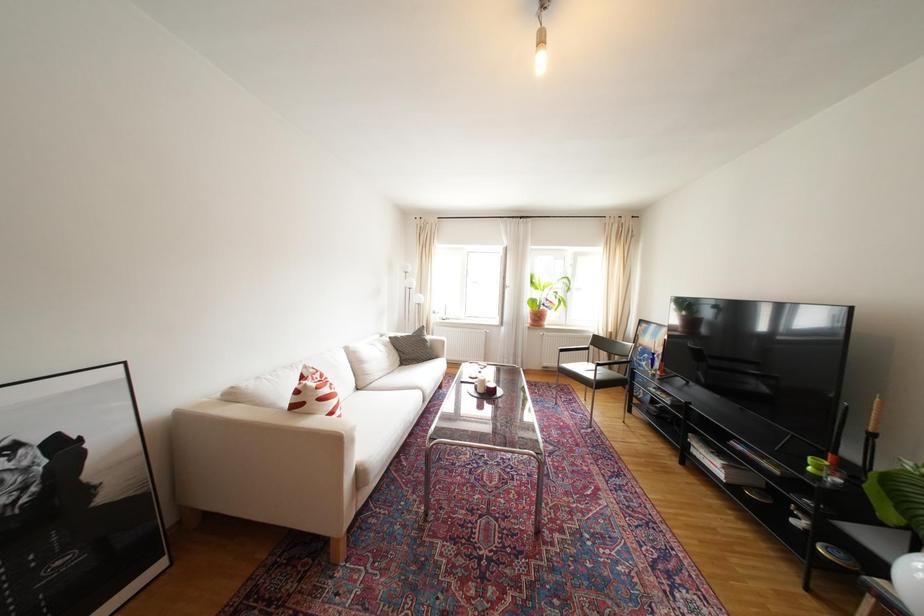
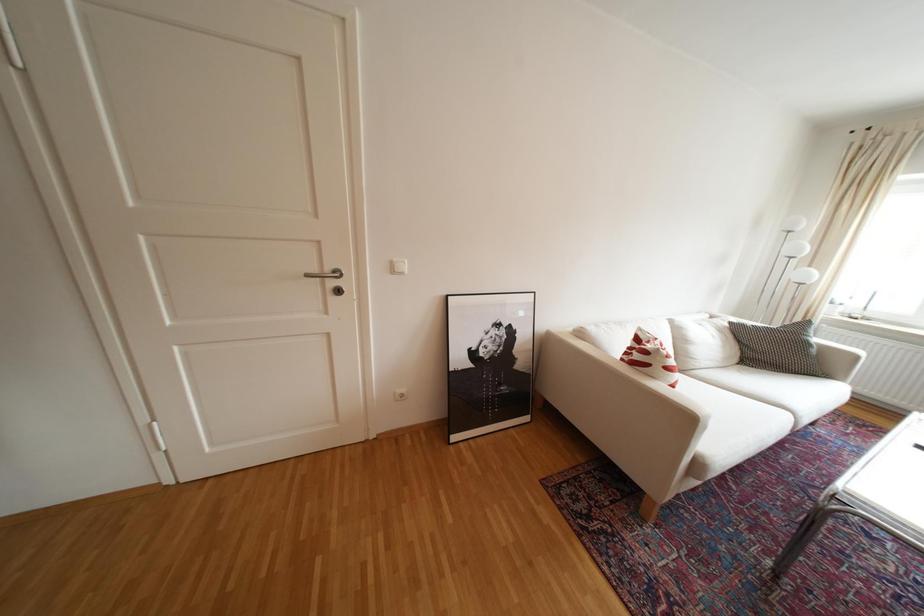
Question: The camera is either moving clockwise (left) or counter-clockwise (right) around the object. The first image is from the beginning of the video and the second image is from the end. Is the camera moving left or right when shooting the video?

Choices:
 (A) Left
 (B) Right

Answer: (B)